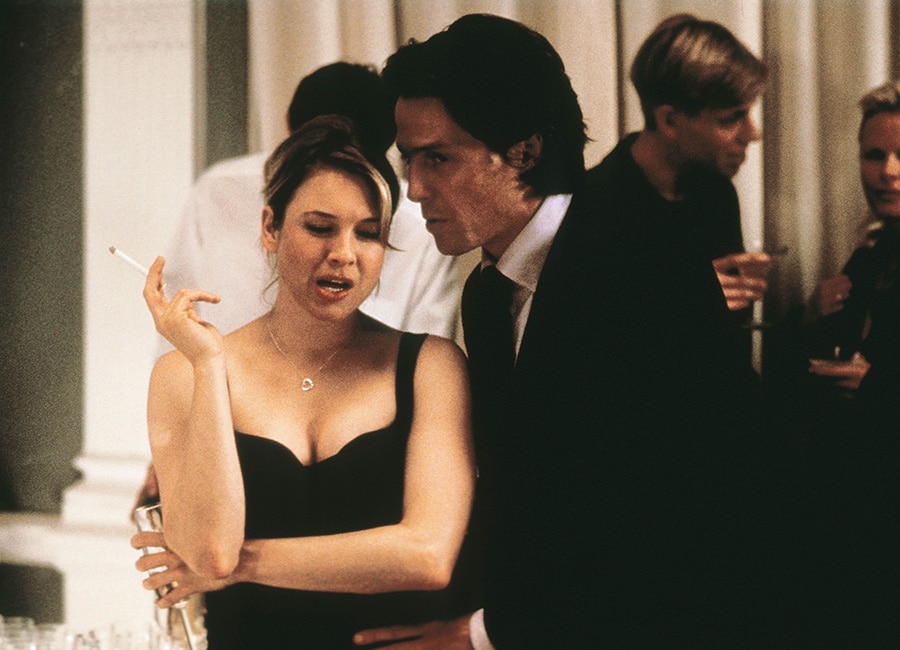
Find the location of `curtains`. curtains is located at coordinates (599, 43).